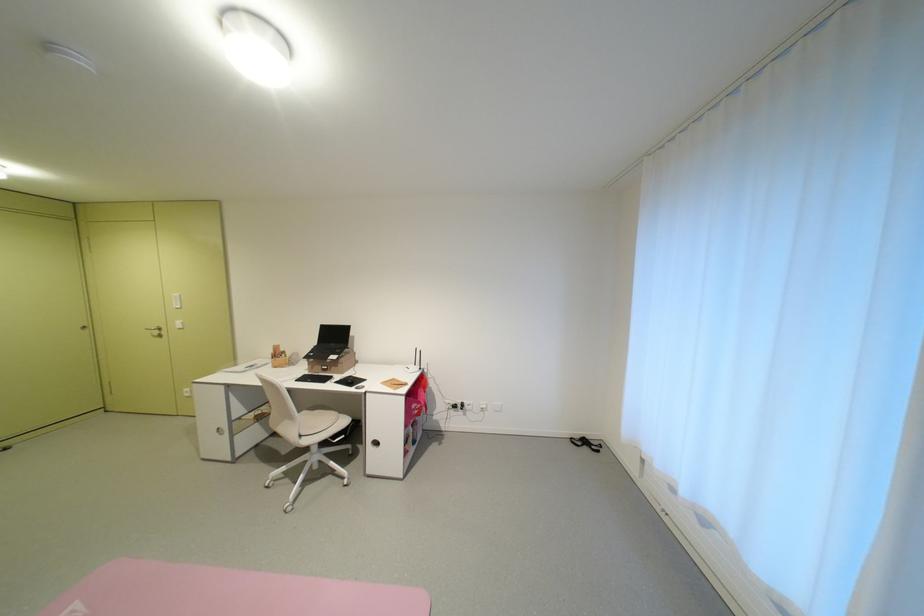
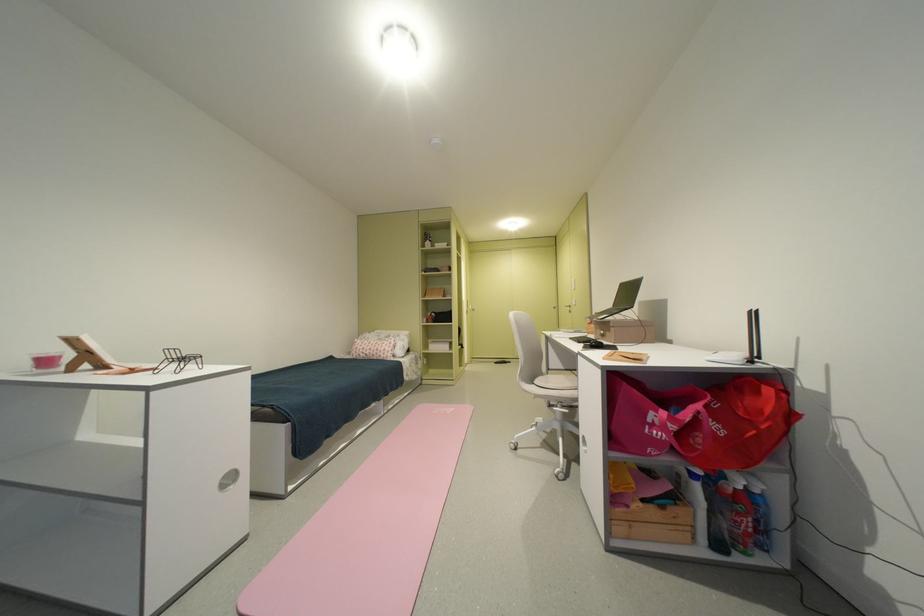
Find the pixel in the second image that matches [418,453] in the first image.

(638, 508)